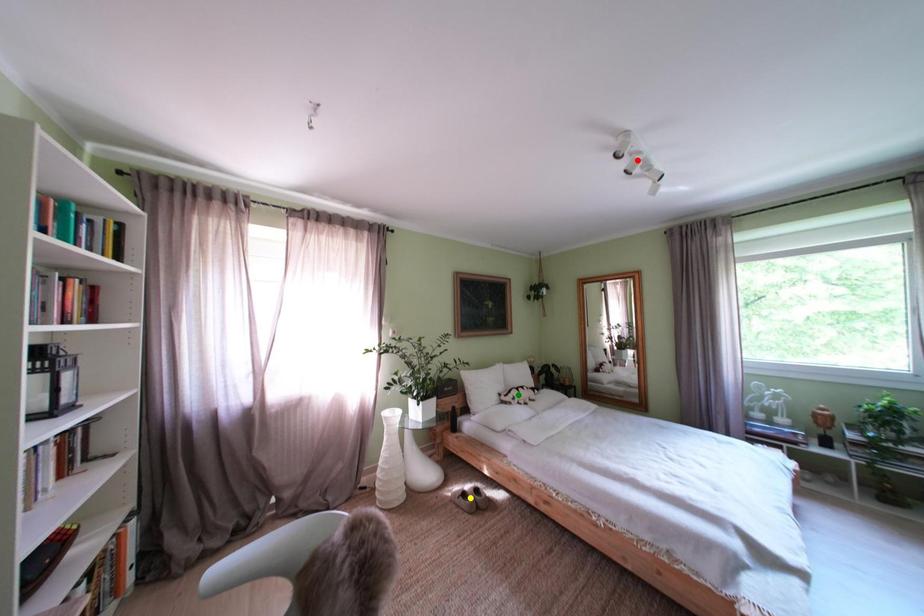
Order these from nearest to farthest:
A) green point
B) yellow point
C) red point

red point → yellow point → green point